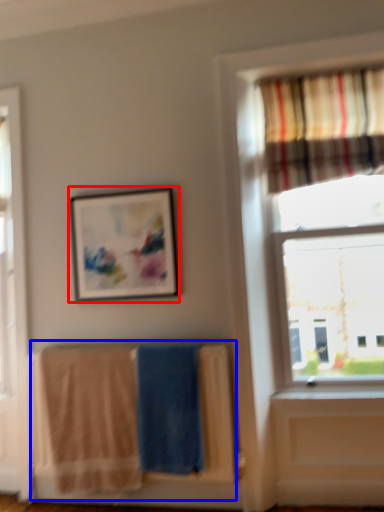
Question: Which object appears closest to the camera in this image, picture frame (highlighted by a red box) or laundry (highlighted by a blue box)?

Choices:
 (A) picture frame
 (B) laundry

Answer: (B)